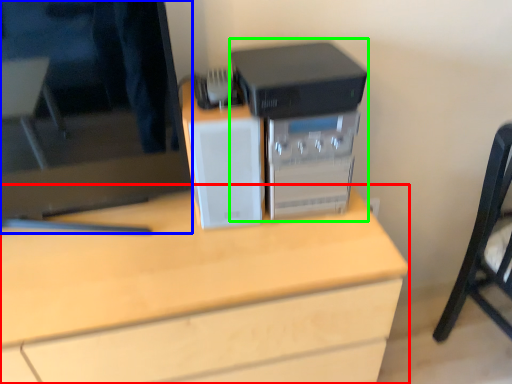
Question: Which is nearer to the desk (highlighted by a red box)? computer monitor (highlighted by a blue box) or home appliance (highlighted by a green box).

Choices:
 (A) computer monitor
 (B) home appliance

Answer: (A)